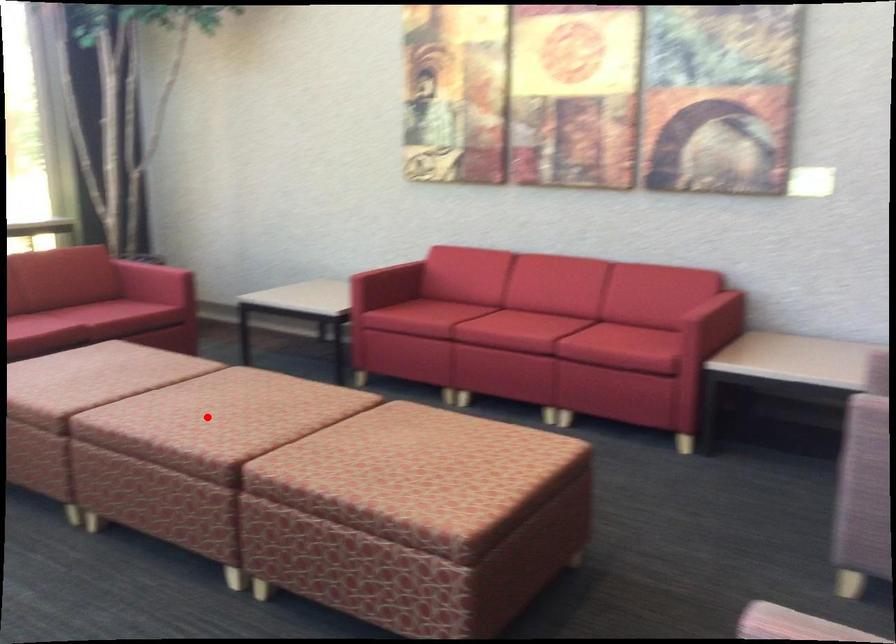
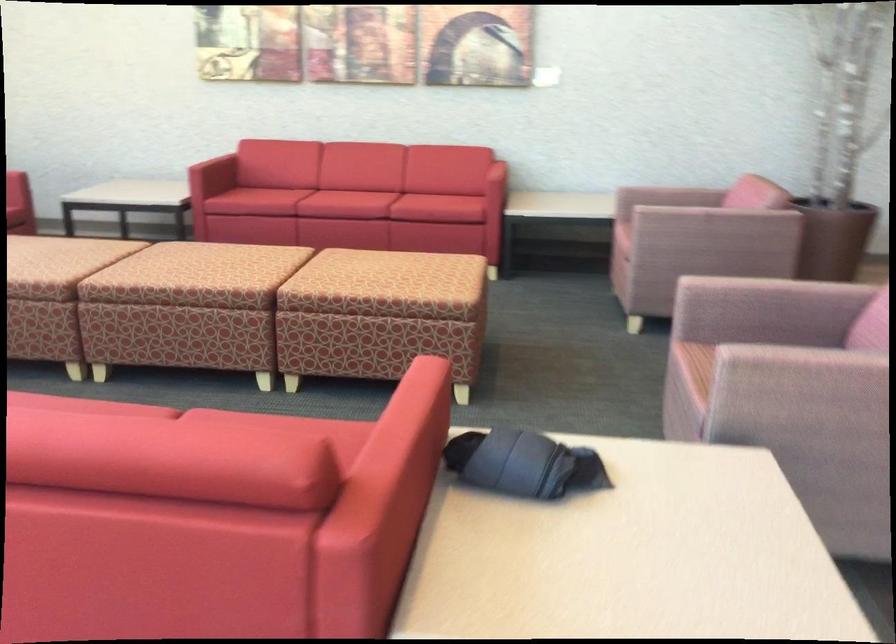
Question: I am providing you with two images of the same scene from different viewpoints. A red point is shown in image1. For the corresponding object point in image2, is it positioned nearer or farther from the camera?

Choices:
 (A) Nearer
 (B) Farther

Answer: (B)